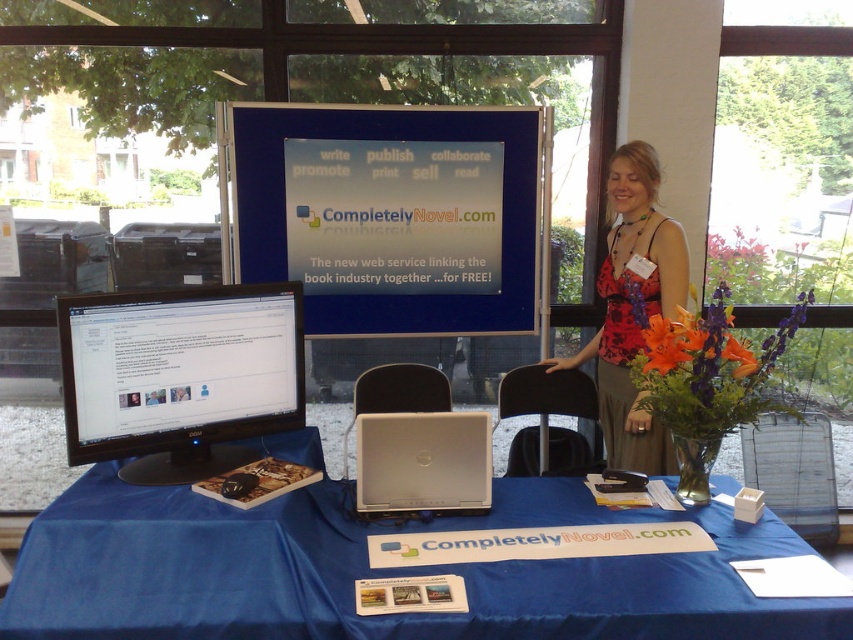
You are a photographer taking a picture of the promotional setup for CompletelyNovel.com. You notice the blue fabric table at center and the blue plastic signboard at center. Which object should you focus on first to ensure it appears larger in the photo?

The blue fabric table at center is closer to the viewer than the blue plastic signboard at center, so focusing on it first will make it appear larger in the photo.